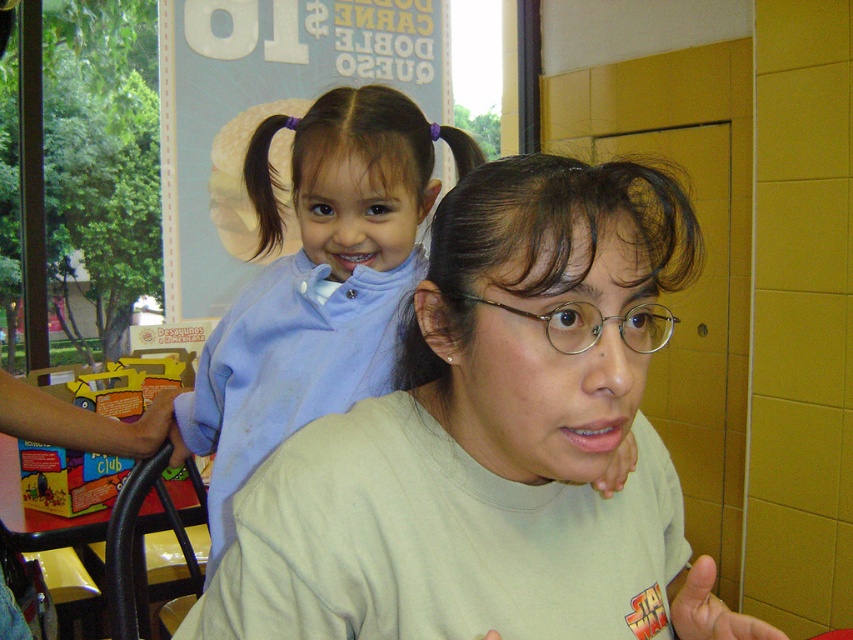
Does point (292, 605) lie in front of point (682, 220)?

Yes.

Locate an element on the screen. light green t-shirt at center is located at coordinates (492, 440).

Where is `light green t-shirt at center`? light green t-shirt at center is located at coordinates (492, 440).

Identify the location of light green t-shirt at center. The width and height of the screenshot is (853, 640). (492, 440).

Between point (216, 499) and point (115, 371), which one is positioned behind?

The point (115, 371) is behind.

Is light blue fabric at upper left to the left of yellow plastic toy car at upper left from the viewer's perspective?

In fact, light blue fabric at upper left is to the right of yellow plastic toy car at upper left.

Who is more distant from viewer, (340, 321) or (131, 413)?

The point (131, 413) is more distant.

The width and height of the screenshot is (853, 640). What are the coordinates of `light blue fabric at upper left` in the screenshot? It's located at (316, 284).

I want to click on yellow plastic toy car at upper left, so click(x=126, y=385).

Is point (125, 369) farther from camera compared to point (254, 193)?

Yes, it is behind point (254, 193).

Between point (138, 356) and point (258, 198), which one is positioned behind?

The point (138, 356) is more distant.

Where is `yellow plastic toy car at upper left`? This screenshot has width=853, height=640. yellow plastic toy car at upper left is located at coordinates (126, 385).